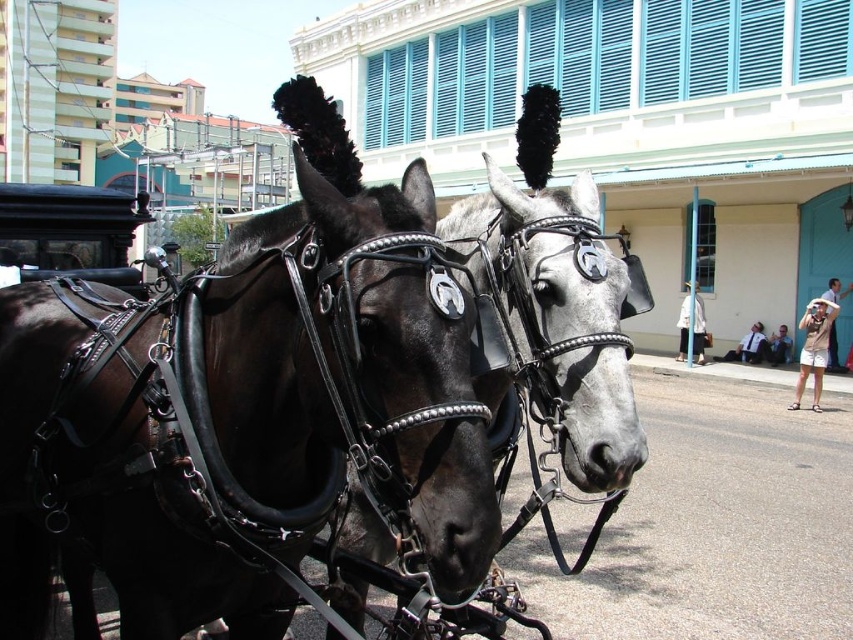
You are a photographer trying to capture a photo of the black leather horse at center and the tan shorts at lower right. You want to ensure both subjects are fully visible in the frame. Which subject should you adjust your camera angle to prioritize if the frame can only accommodate one subject in full? Explain your reasoning based on their sizes.

The black leather horse at center has a lesser width compared to the tan shorts at lower right. Therefore, you should prioritize capturing the tan shorts at lower right in full since it is wider and might require more space to fit entirely within the frame.

You are standing in the scene and see the tan shorts at lower right and the light blue denim jacket at lower right. Which item is physically closer to you?

The tan shorts at lower right are closer to the viewer than the light blue denim jacket at lower right.

You are standing in front of the carriage and want to locate the black leather horse at center. According to the coordinates provided, where should you look relative to your position?

You should look towards the lower right direction since the black leather horse at center is located at coordinate point (596, 417), which corresponds to the lower right area from your perspective.